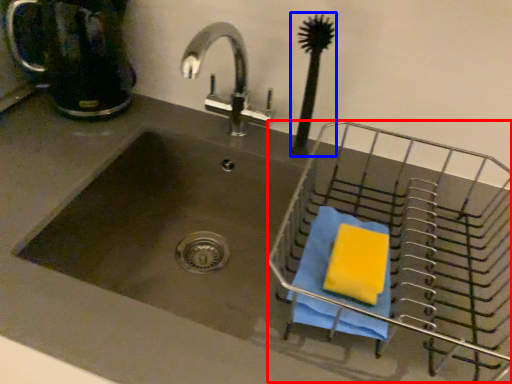
Question: Which object appears closest to the camera in this image, basket (highlighted by a red box) or brush (highlighted by a blue box)?

Choices:
 (A) basket
 (B) brush

Answer: (A)